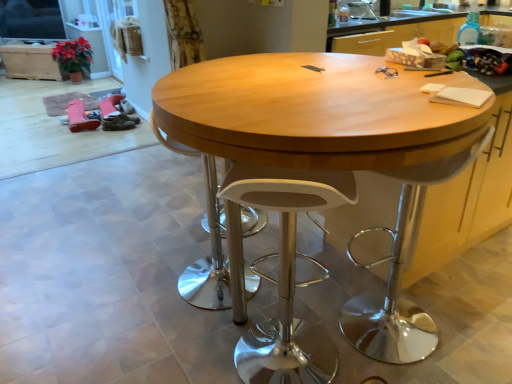
Question: Is there a large distance between wooden table at center and white plastic swivel chair at center, the second swivel chair viewed from the right?

Choices:
 (A) no
 (B) yes

Answer: (A)

Question: Is wooden table at center bigger than white plastic swivel chair at center, the first swivel chair when ordered from left to right?

Choices:
 (A) yes
 (B) no

Answer: (A)

Question: Does wooden table at center have a greater height compared to white plastic swivel chair at center, the second swivel chair viewed from the right?

Choices:
 (A) yes
 (B) no

Answer: (A)

Question: Is wooden table at center looking in the opposite direction of white plastic swivel chair at center, the second swivel chair viewed from the right?

Choices:
 (A) no
 (B) yes

Answer: (A)

Question: From the image's perspective, does wooden table at center appear higher than white plastic swivel chair at center, the second swivel chair viewed from the right?

Choices:
 (A) no
 (B) yes

Answer: (B)

Question: Does wooden table at center lie in front of white plastic swivel chair at center, the first swivel chair when ordered from left to right?

Choices:
 (A) no
 (B) yes

Answer: (B)

Question: Can you confirm if white plastic stool at center is smaller than wooden cabinet at upper left?

Choices:
 (A) no
 (B) yes

Answer: (B)

Question: Is white plastic stool at center to the right of wooden cabinet at upper left from the viewer's perspective?

Choices:
 (A) yes
 (B) no

Answer: (A)

Question: Considering the relative sizes of white plastic stool at center and wooden cabinet at upper left in the image provided, is white plastic stool at center thinner than wooden cabinet at upper left?

Choices:
 (A) no
 (B) yes

Answer: (B)

Question: Is white plastic stool at center with wooden cabinet at upper left?

Choices:
 (A) yes
 (B) no

Answer: (B)

Question: From a real-world perspective, is white plastic stool at center over wooden cabinet at upper left?

Choices:
 (A) no
 (B) yes

Answer: (B)

Question: Does white plastic stool at center have a larger size compared to wooden cabinet at upper left?

Choices:
 (A) no
 (B) yes

Answer: (A)

Question: Considering the relative sizes of white plastic swivel chair at center, the second swivel chair viewed from the right, and white plastic swivel chair at right, the first swivel chair in the right-to-left sequence, in the image provided, is white plastic swivel chair at center, the second swivel chair viewed from the right, thinner than white plastic swivel chair at right, the first swivel chair in the right-to-left sequence,?

Choices:
 (A) yes
 (B) no

Answer: (B)